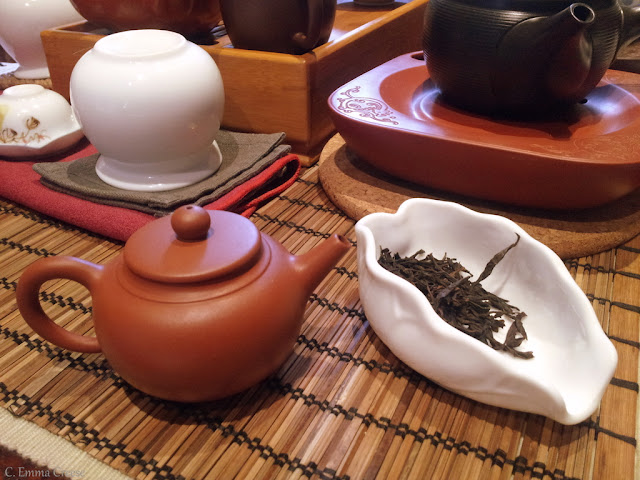
I want to click on table mat, so click(x=374, y=389).